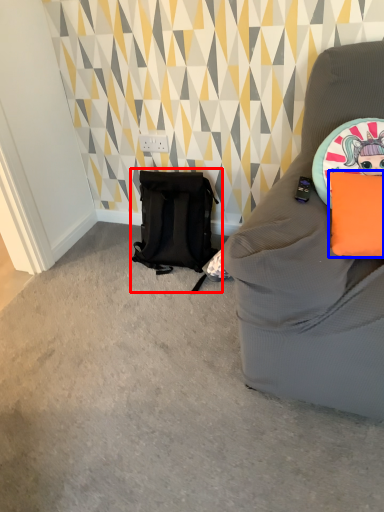
Question: Which object is further to the camera taking this photo, backpack (highlighted by a red box) or pillow (highlighted by a blue box)?

Choices:
 (A) backpack
 (B) pillow

Answer: (A)